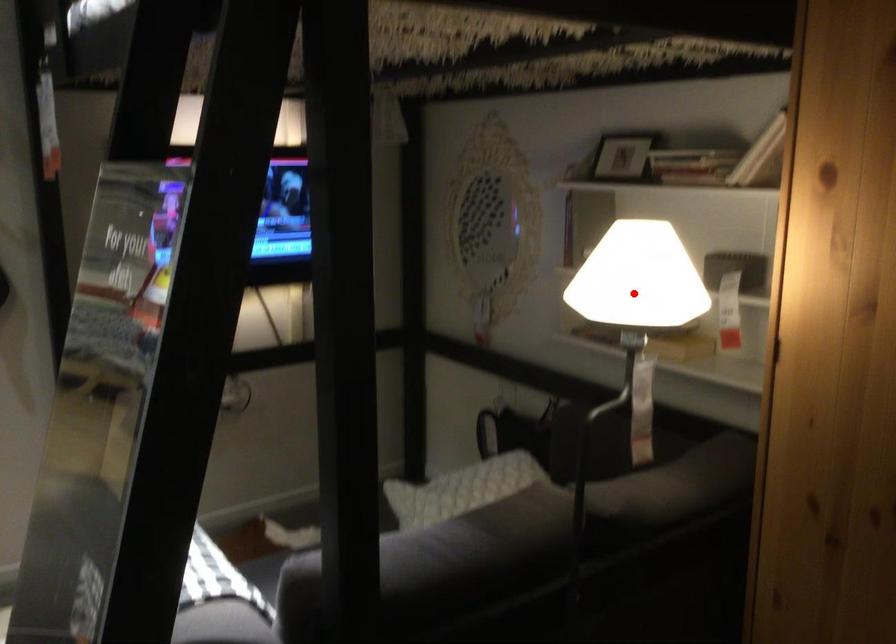
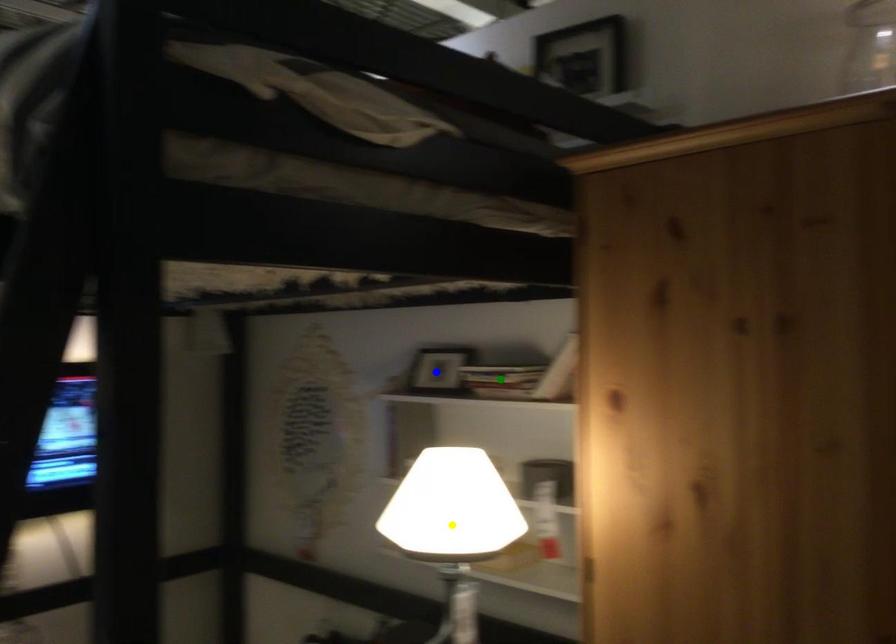
Question: I am providing you with two images of the same scene from different viewpoints. A red point is marked on the first image. You are given multiple points on the second image. Which point in image 2 is actually the same real-world point as the red point in image 1?

Choices:
 (A) blue point
 (B) green point
 (C) yellow point

Answer: (C)